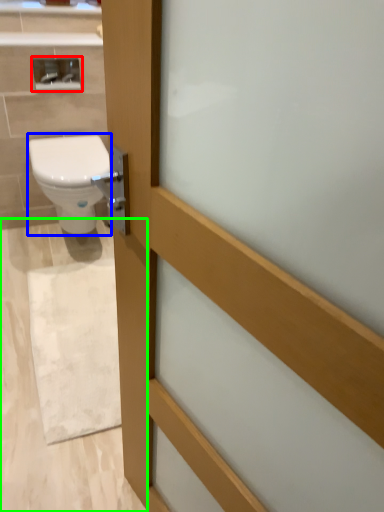
Question: Estimate the real-world distances between objects in this image. Which object is closer to medicine cabinet (highlighted by a red box), bidet (highlighted by a blue box) or plain (highlighted by a green box)?

Choices:
 (A) bidet
 (B) plain

Answer: (A)